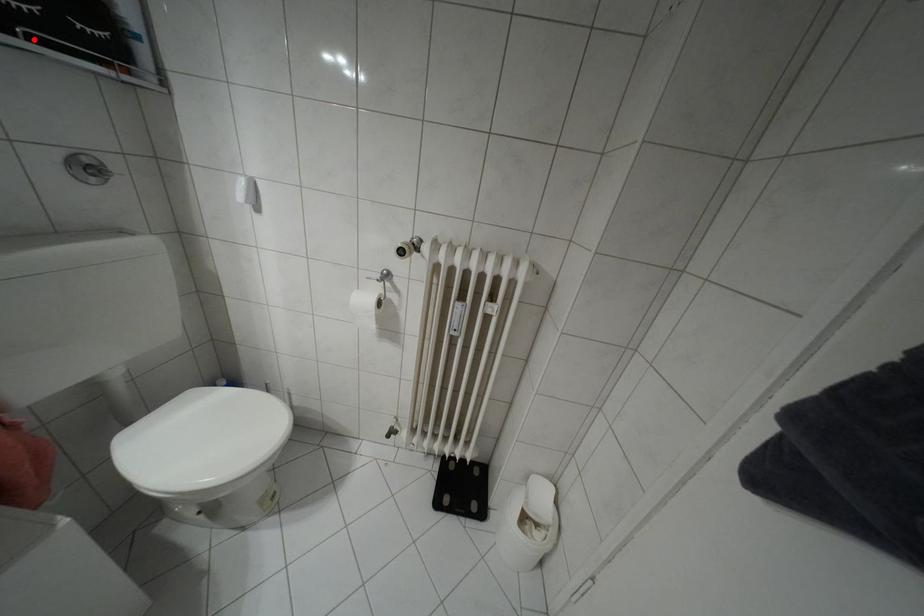
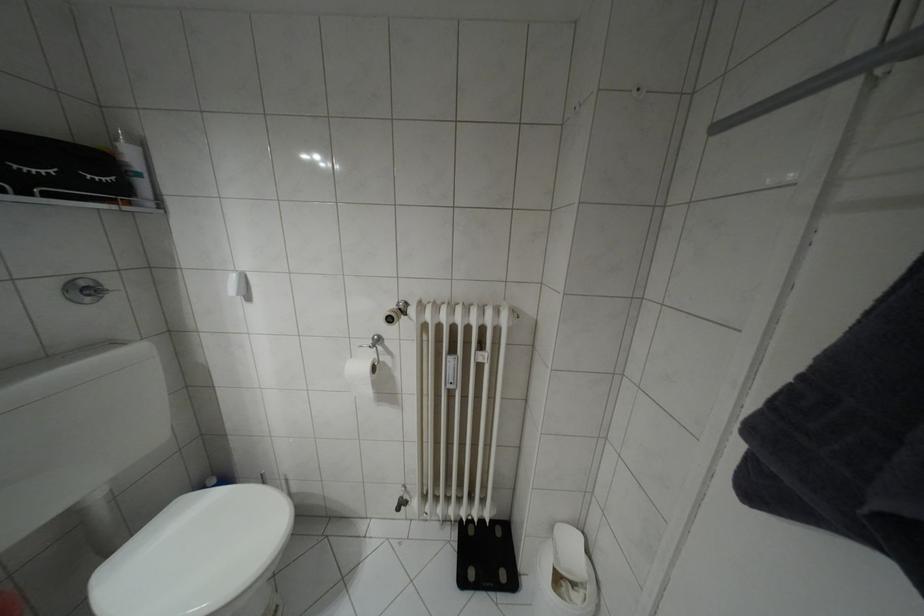
Find the pixel in the second image that matches the highlighted location in the first image.

(49, 195)